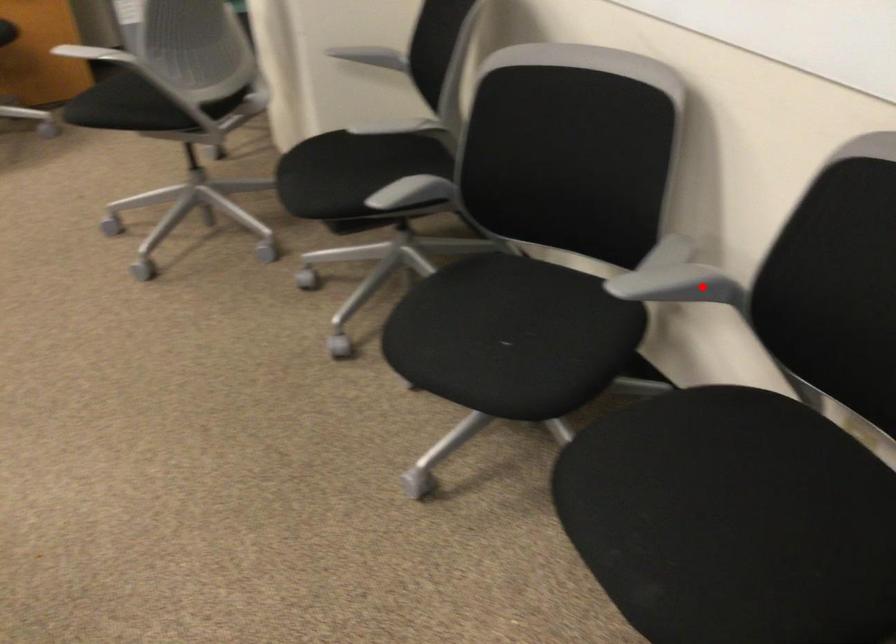
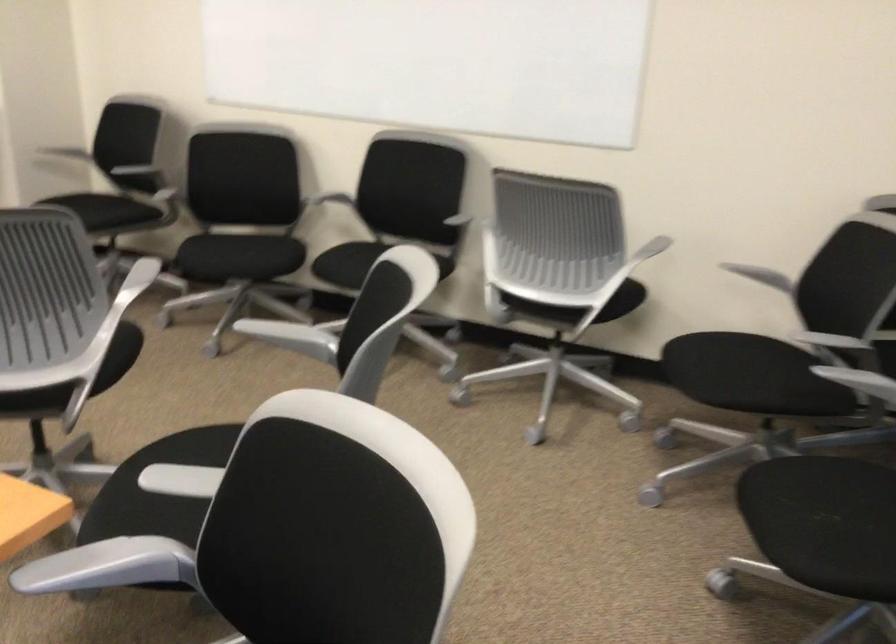
Question: I am providing you with two images of the same scene from different viewpoints. In image1, a red point is highlighted. Considering the same 3D point in image2, which of the following is correct?

Choices:
 (A) It is closer
 (B) It is farther

Answer: (B)